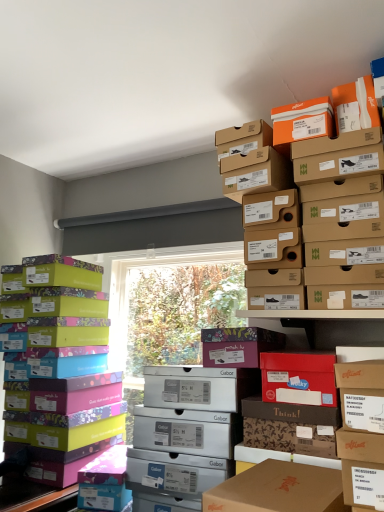
Locate an element on the screen. The image size is (384, 512). cardboard shoebox at upper center is located at coordinates (255, 173).

Describe the element at coordinates (255, 173) in the screenshot. Image resolution: width=384 pixels, height=512 pixels. I see `cardboard shoebox at upper center` at that location.

Describe the element at coordinates (64, 367) in the screenshot. I see `multicolored cardboard shoebox at left` at that location.

The width and height of the screenshot is (384, 512). I want to click on cardboard shoebox at upper center, so click(255, 173).

Considering the relative positions of matte purple shoebox at center and multicolored cardboard shoebox at left in the image provided, is matte purple shoebox at center to the right of multicolored cardboard shoebox at left from the viewer's perspective?

Yes, matte purple shoebox at center is to the right of multicolored cardboard shoebox at left.

Which object is thinner, matte purple shoebox at center or multicolored cardboard shoebox at left?

Thinner between the two is matte purple shoebox at center.

From the image's perspective, is matte purple shoebox at center below multicolored cardboard shoebox at left?

No, from the image's perspective, matte purple shoebox at center is not beneath multicolored cardboard shoebox at left.

From the image's perspective, is matte purple shoebox at center located above or below cardboard shoebox at upper center?

matte purple shoebox at center is below cardboard shoebox at upper center.

From a real-world perspective, which object stands above the other?

From a 3D spatial view, cardboard shoebox at upper center is above.

Is matte purple shoebox at center looking in the opposite direction of cardboard shoebox at upper center?

No, matte purple shoebox at center is not facing the opposite direction of cardboard shoebox at upper center.

Is matte purple shoebox at center placed right next to cardboard shoebox at upper center?

matte purple shoebox at center and cardboard shoebox at upper center are clearly separated.

I want to click on storage box that is above the multicolored cardboard shoebox at left (from the image's perspective), so click(255, 173).

From a real-world perspective, who is located higher, multicolored cardboard shoebox at left or cardboard shoebox at upper center?

From a 3D spatial view, cardboard shoebox at upper center is above.

From the image's perspective, is multicolored cardboard shoebox at left on top of cardboard shoebox at upper center?

Actually, multicolored cardboard shoebox at left appears below cardboard shoebox at upper center in the image.

Is multicolored cardboard shoebox at left looking in the opposite direction of cardboard shoebox at upper center?

No, cardboard shoebox at upper center is not at the back of multicolored cardboard shoebox at left.

Is cardboard shoebox at upper center situated inside multicolored cardboard shoebox at left or outside?

cardboard shoebox at upper center exists outside the volume of multicolored cardboard shoebox at left.

From a real-world perspective, who is located lower, cardboard shoebox at upper center or multicolored cardboard shoebox at left?

multicolored cardboard shoebox at left is physically lower.

From a real-world perspective, does multicolored cardboard shoebox at left sit lower than matte purple shoebox at center?

Yes, from a real-world perspective, multicolored cardboard shoebox at left is beneath matte purple shoebox at center.

Is multicolored cardboard shoebox at left oriented towards matte purple shoebox at center?

No, multicolored cardboard shoebox at left does not turn towards matte purple shoebox at center.

Would you say multicolored cardboard shoebox at left is a long distance from matte purple shoebox at center?

No, multicolored cardboard shoebox at left is not far away from matte purple shoebox at center.

Which is in front, multicolored cardboard shoebox at left or matte purple shoebox at center?

matte purple shoebox at center is in front.

Based on their sizes in the image, would you say cardboard shoebox at upper center is bigger or smaller than matte purple shoebox at center?

In the image, cardboard shoebox at upper center appears to be larger than matte purple shoebox at center.

Is cardboard shoebox at upper center facing towards matte purple shoebox at center?

No, cardboard shoebox at upper center is not oriented towards matte purple shoebox at center.

Based on the photo, can you confirm if cardboard shoebox at upper center is positioned to the right of matte purple shoebox at center?

Indeed, cardboard shoebox at upper center is positioned on the right side of matte purple shoebox at center.

Is the depth of cardboard shoebox at upper center greater than that of matte purple shoebox at center?

That is False.

Locate an element on the screen. cardboard box in front of the multicolored cardboard shoebox at left is located at coordinates (238, 346).

I want to click on storage box above the matte purple shoebox at center (from a real-world perspective), so click(x=255, y=173).

Considering their positions, is cardboard shoebox at upper center positioned closer to matte purple shoebox at center than multicolored cardboard shoebox at left?

Among the two, cardboard shoebox at upper center is located nearer to matte purple shoebox at center.

From the image, which object appears to be nearer to multicolored cardboard shoebox at left, matte purple shoebox at center or cardboard shoebox at upper center?

matte purple shoebox at center.

From the image, which object appears to be nearer to matte purple shoebox at center, multicolored cardboard shoebox at left or cardboard shoebox at upper center?

Among the two, cardboard shoebox at upper center is located nearer to matte purple shoebox at center.

From the image, which object appears to be farther from cardboard shoebox at upper center, multicolored cardboard shoebox at left or matte purple shoebox at center?

multicolored cardboard shoebox at left.

Looking at the image, which one is located closer to cardboard shoebox at upper center, matte purple shoebox at center or multicolored cardboard shoebox at left?

matte purple shoebox at center.

Estimate the real-world distances between objects in this image. Which object is closer to multicolored cardboard shoebox at left, cardboard shoebox at upper center or matte purple shoebox at center?

The object closer to multicolored cardboard shoebox at left is matte purple shoebox at center.

The width and height of the screenshot is (384, 512). In order to click on cardboard box situated between multicolored cardboard shoebox at left and cardboard shoebox at upper center from left to right in this screenshot , I will do `click(238, 346)`.